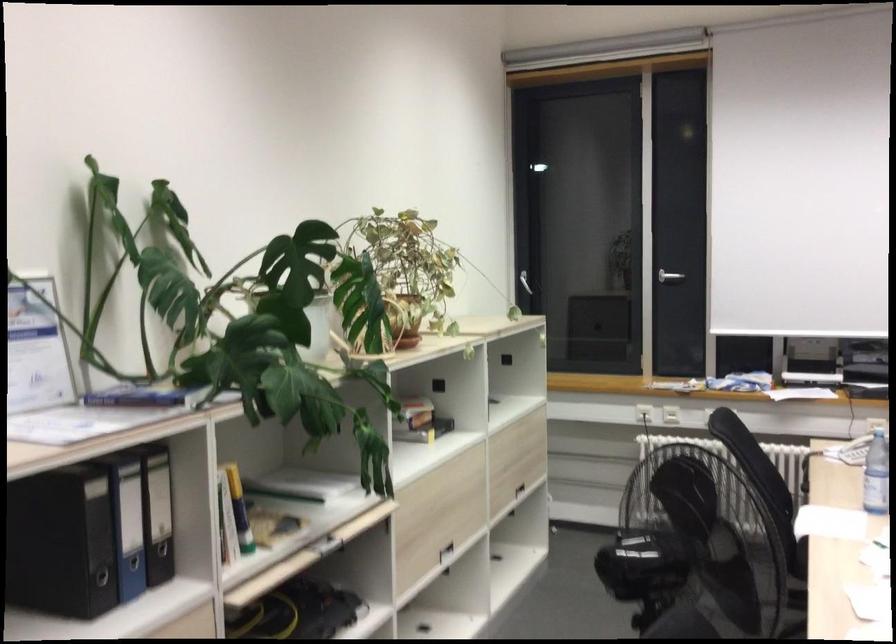
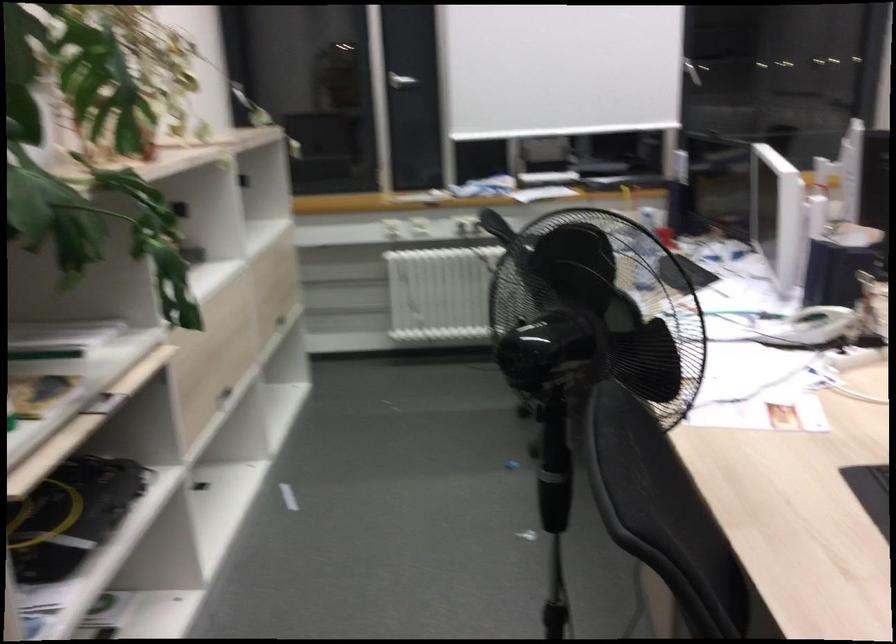
The images are taken continuously from a first-person perspective. In which direction are you moving?

The movement direction of the cameraman is left, forward.